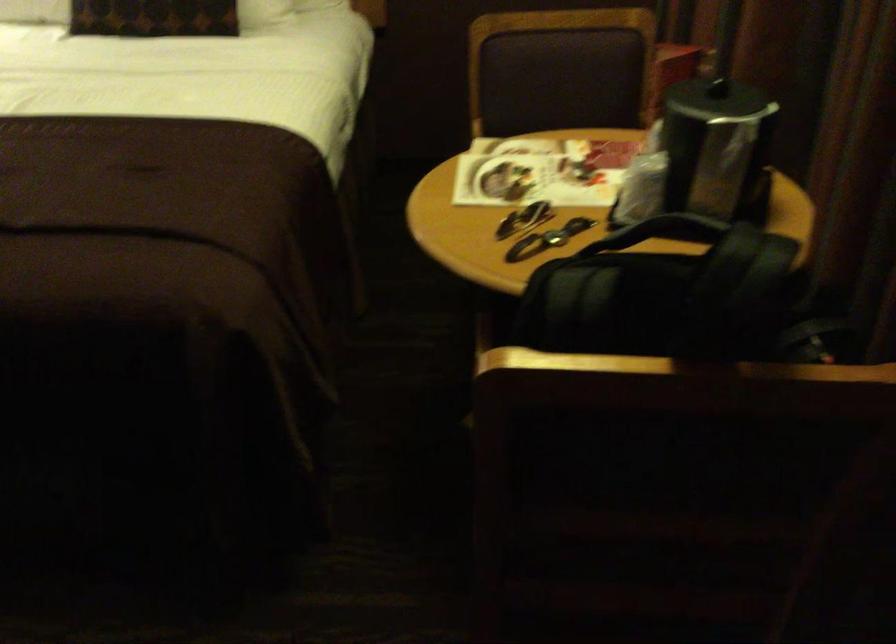
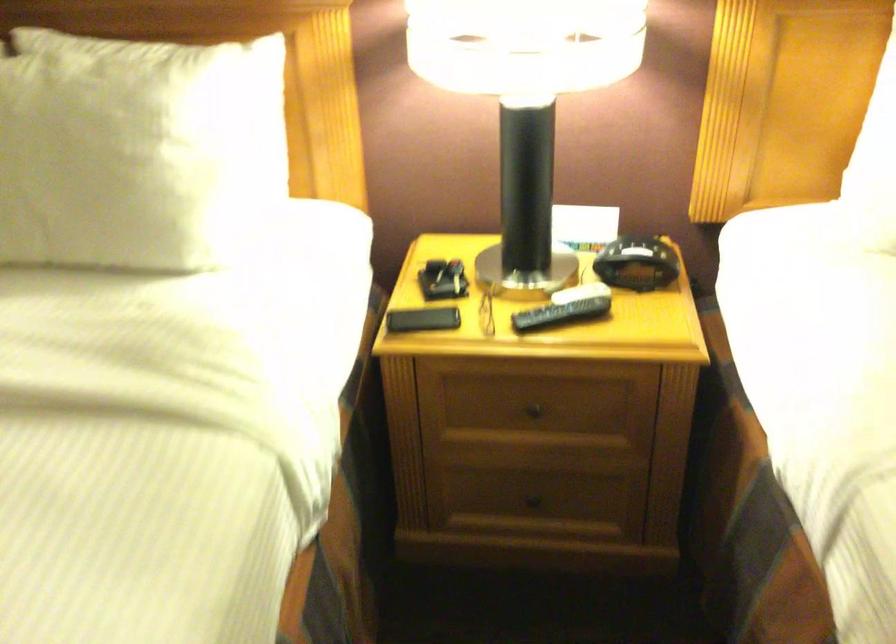
What movement of the cameraman would produce the second image?

The movement direction of the cameraman is left, forward.